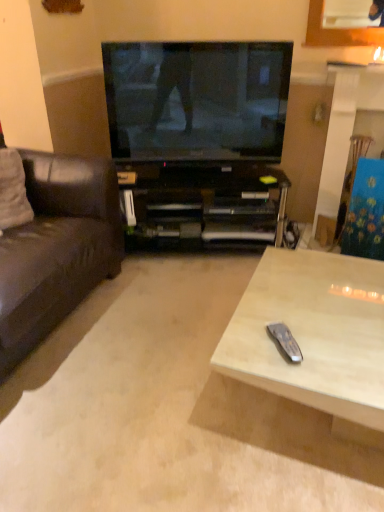
You are a GUI agent. You are given a task and a screenshot of the screen. Output one action in this format:
    pyautogui.click(x=<x>, y=<y>)
    Task: Click on the free location above light wood/texture remote control at lower right (from a real-world perspective)
    
    Given the screenshot: What is the action you would take?
    pyautogui.click(x=317, y=310)